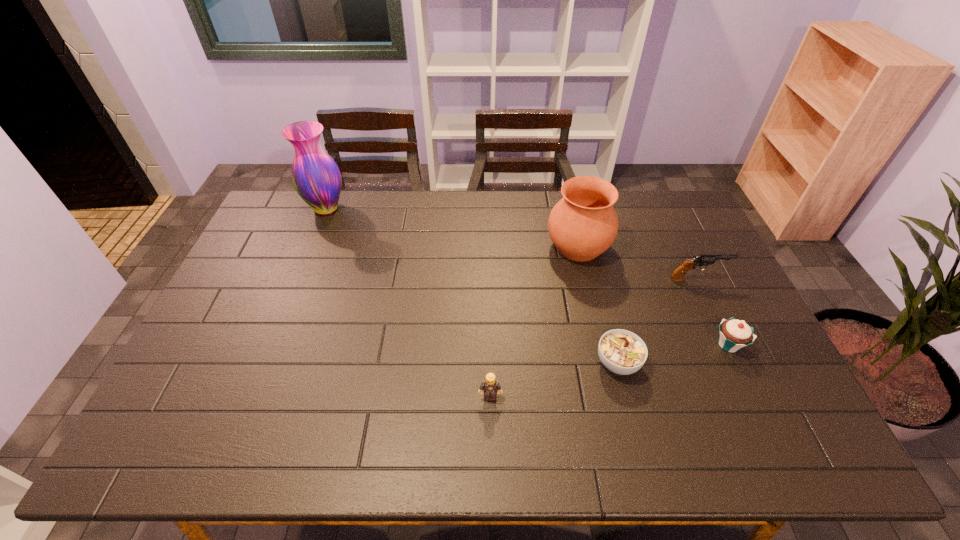
This screenshot has width=960, height=540. Find the location of `free space at the far edge of the desktop`. free space at the far edge of the desktop is located at coordinates (322, 226).

Identify the location of vacant space at the near edge of the desktop. (693, 425).

At what (x,y) coordinates should I click in order to perform the action: click on vacant region at the left edge of the desktop. Please return your answer as a coordinate pair (x, y). This screenshot has height=540, width=960. Looking at the image, I should click on (224, 331).

The width and height of the screenshot is (960, 540). What are the coordinates of `free location at the right edge of the desktop` in the screenshot? It's located at (690, 247).

The width and height of the screenshot is (960, 540). Identify the location of vacant area at the far left corner of the desktop. point(290,193).

In the image, there is a desktop. Identify the location of vacant space at the far right corner. (658, 202).

I want to click on free space at the near right corner, so click(757, 451).

Find the location of a particular element. The image size is (960, 540). free space between the farthest object and the cupcake is located at coordinates (527, 276).

Locate an element on the screen. The image size is (960, 540). free space that is in between the third farthest object and the cupcake is located at coordinates (713, 312).

At what (x,y) coordinates should I click in order to perform the action: click on vacant space that is in between the pottery and the nearest object. Please return your answer as a coordinate pair (x, y). The width and height of the screenshot is (960, 540). Looking at the image, I should click on (534, 321).